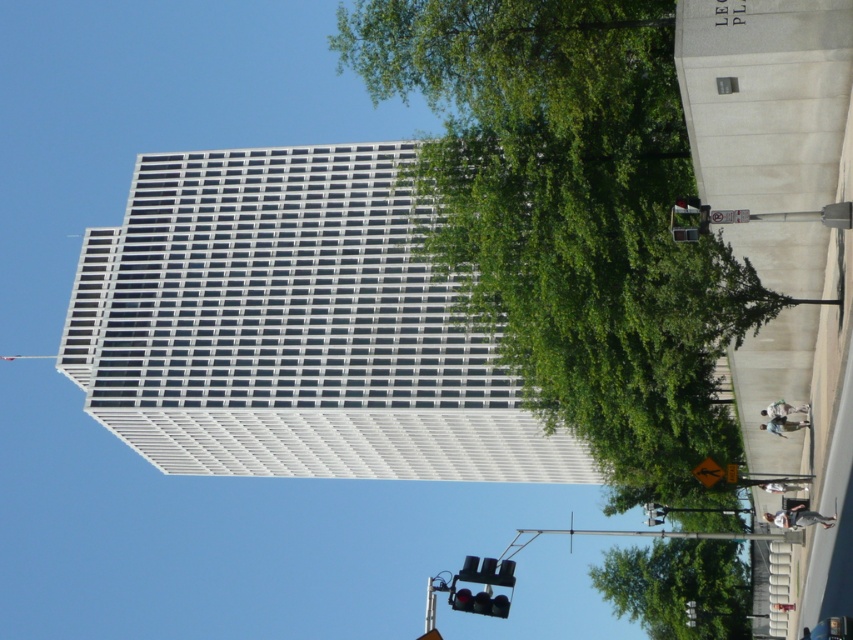
Question: Which point is closer to the camera taking this photo?

Choices:
 (A) (625, 572)
 (B) (508, 214)

Answer: (B)

Question: Is green leafy tree at upper center below black glass traffic light at lower center?

Choices:
 (A) no
 (B) yes

Answer: (A)

Question: Is green leafy tree at upper center in front of black glass traffic light at lower center?

Choices:
 (A) no
 (B) yes

Answer: (A)

Question: Can you confirm if green leafy tree at lower center is positioned above black glass traffic light at lower center?

Choices:
 (A) no
 (B) yes

Answer: (A)

Question: Among these points, which one is nearest to the camera?

Choices:
 (A) (715, 554)
 (B) (730, 579)
 (C) (456, 598)

Answer: (C)

Question: Which point appears closest to the camera in this image?

Choices:
 (A) (480, 602)
 (B) (703, 384)

Answer: (A)